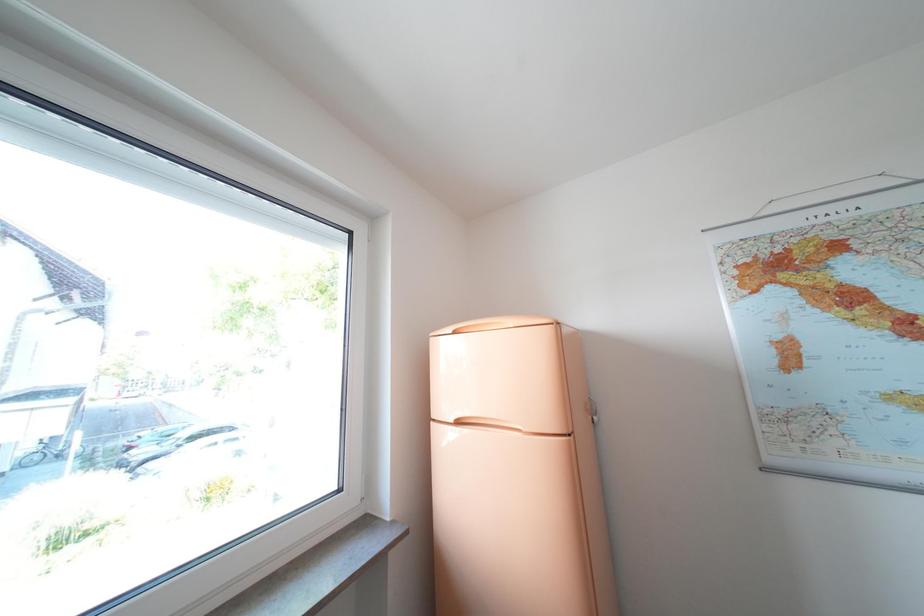
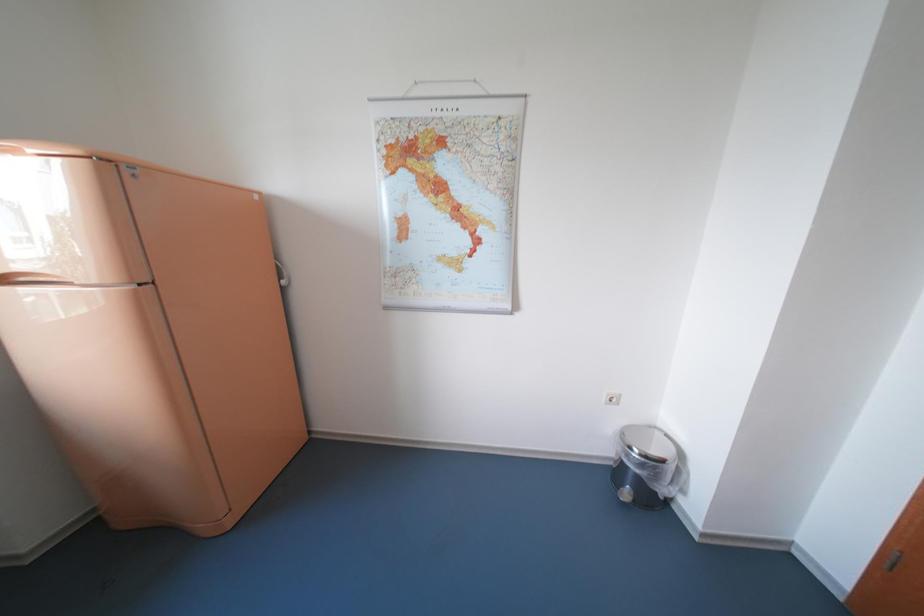
How did the camera likely rotate?

The camera's rotation is toward right-down.